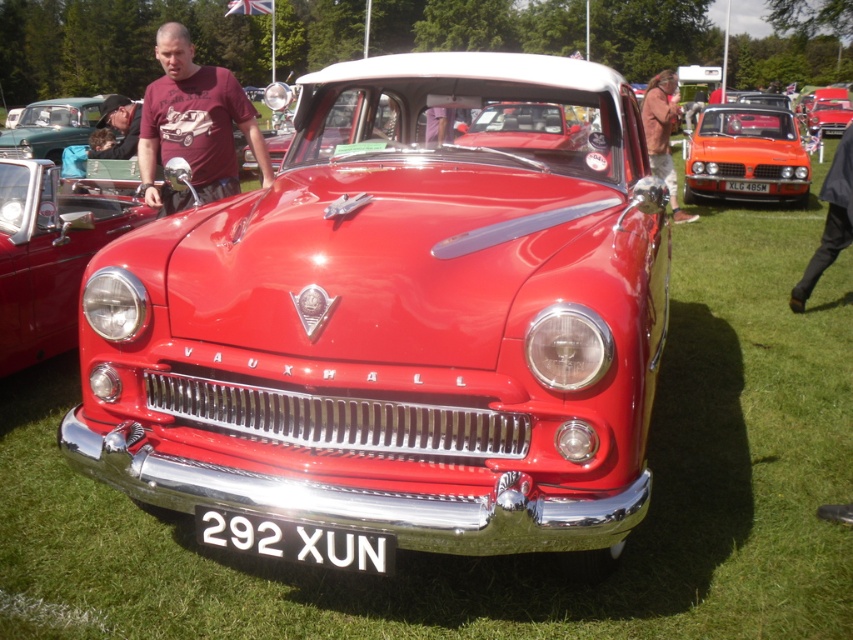
Question: Is shiny red car at center to the left of white plastic license plate at center from the viewer's perspective?

Choices:
 (A) yes
 (B) no

Answer: (A)

Question: Is shiny red car at center in front of glossy red car at center?

Choices:
 (A) no
 (B) yes

Answer: (B)

Question: Does shiny red car at center have a larger size compared to brown leather jacket at upper center?

Choices:
 (A) no
 (B) yes

Answer: (A)

Question: Which point is closer to the camera?

Choices:
 (A) glossy red car at center
 (B) white metallic license plate at center
 (C) brown leather jacket at upper center

Answer: (B)

Question: Which of the following is the farthest from the observer?

Choices:
 (A) (32, 188)
 (B) (152, 120)
 (C) (665, 173)

Answer: (C)

Question: Which object appears farthest from the camera in this image?

Choices:
 (A) metallic silver car at upper left
 (B) dark brown leather jacket at upper left
 (C) white metallic license plate at center
 (D) shiny orange car at center

Answer: (A)